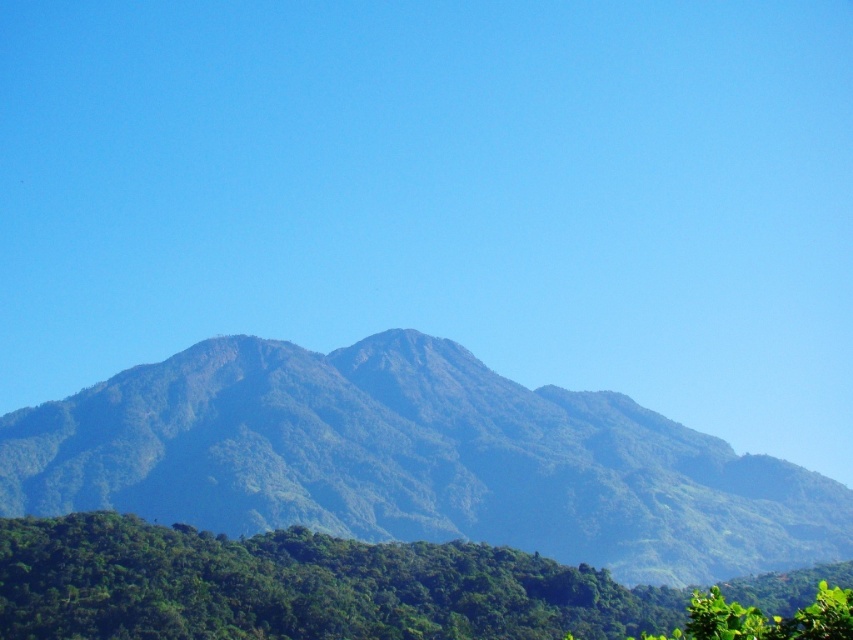
Question: In this image, where is green leafy mountain range at center located relative to green leafy tree at lower center?

Choices:
 (A) above
 (B) below

Answer: (A)

Question: Is green leafy mountain range at center smaller than green leafy tree at lower center?

Choices:
 (A) no
 (B) yes

Answer: (A)

Question: Which of the following is the closest to the observer?

Choices:
 (A) (45, 496)
 (B) (746, 593)

Answer: (B)

Question: Does green leafy mountain range at center appear under green leafy tree at lower center?

Choices:
 (A) yes
 (B) no

Answer: (B)

Question: Which object is closer to the camera taking this photo?

Choices:
 (A) green leafy tree at lower center
 (B) green leafy mountain range at center

Answer: (A)